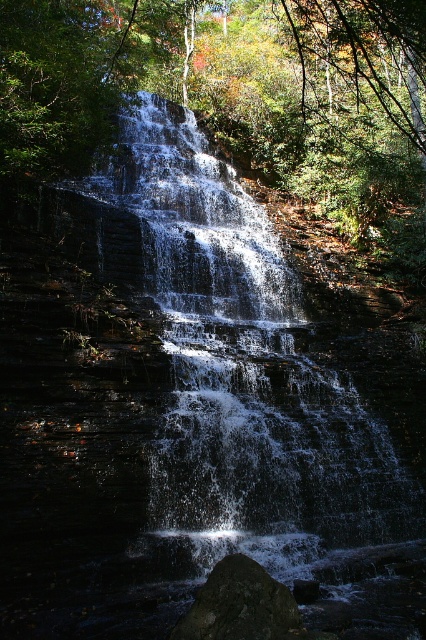
Does white frothy water at center appear over dark gray rock at center?

Yes, white frothy water at center is above dark gray rock at center.

Consider the image. Does white frothy water at center appear on the left side of dark gray rock at center?

Correct, you'll find white frothy water at center to the left of dark gray rock at center.

This screenshot has height=640, width=426. Find the location of `white frothy water at center`. white frothy water at center is located at coordinates (244, 372).

Where is `white frothy water at center`? The image size is (426, 640). white frothy water at center is located at coordinates (244, 372).